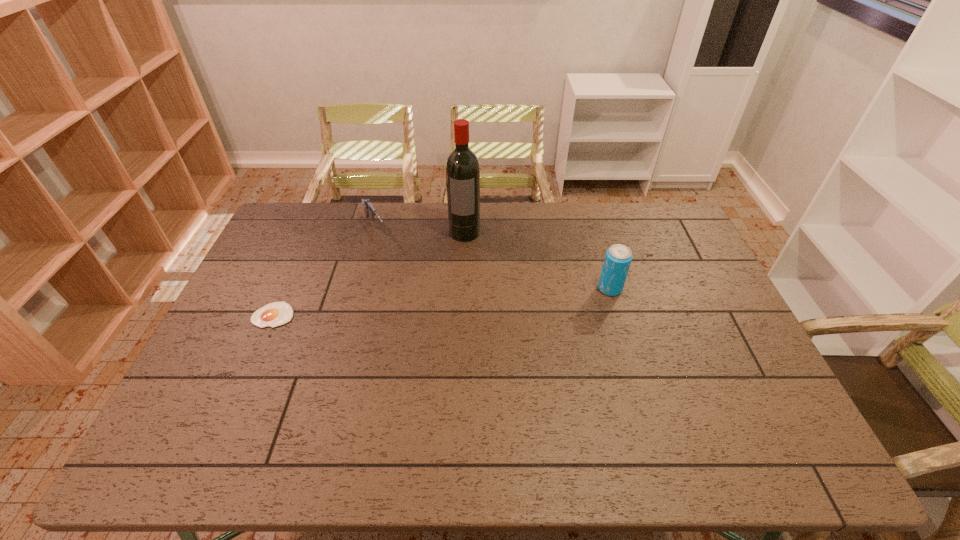
The height and width of the screenshot is (540, 960). In order to click on vacant space located on the label of the second object from right to left in this screenshot , I will do 460,279.

Find the location of a particular element. blank space located on the label of the second object from right to left is located at coordinates (459, 291).

You are a GUI agent. You are given a task and a screenshot of the screen. Output one action in this format:
    pyautogui.click(x=<x>, y=<y>)
    Task: Click on the blank space located 0.210m on the label of the second object from right to left
    This screenshot has width=960, height=540.
    Given the screenshot: What is the action you would take?
    pyautogui.click(x=460, y=284)

Locate an element on the screen. The image size is (960, 540). free space located at the barrel of the third object from right to left is located at coordinates (394, 265).

Image resolution: width=960 pixels, height=540 pixels. Identify the location of vacant space situated at the barrel of the third object from right to left. (403, 279).

You are a GUI agent. You are given a task and a screenshot of the screen. Output one action in this format:
    pyautogui.click(x=<x>, y=<y>)
    Task: Click on the vacant space located 0.140m at the barrel of the third object from right to left
    This screenshot has height=540, width=960.
    Given the screenshot: What is the action you would take?
    pyautogui.click(x=395, y=267)

At what (x,y) coordinates should I click in order to perform the action: click on wine bottle located in the far edge section of the desktop. Please return your answer as a coordinate pair (x, y). The image size is (960, 540). Looking at the image, I should click on (462, 166).

The height and width of the screenshot is (540, 960). In order to click on gun located in the far edge section of the desktop in this screenshot , I will do `click(369, 210)`.

This screenshot has height=540, width=960. Identify the location of object that is at the left edge. (274, 314).

Where is `free space at the far edge of the desktop`? The image size is (960, 540). free space at the far edge of the desktop is located at coordinates (498, 209).